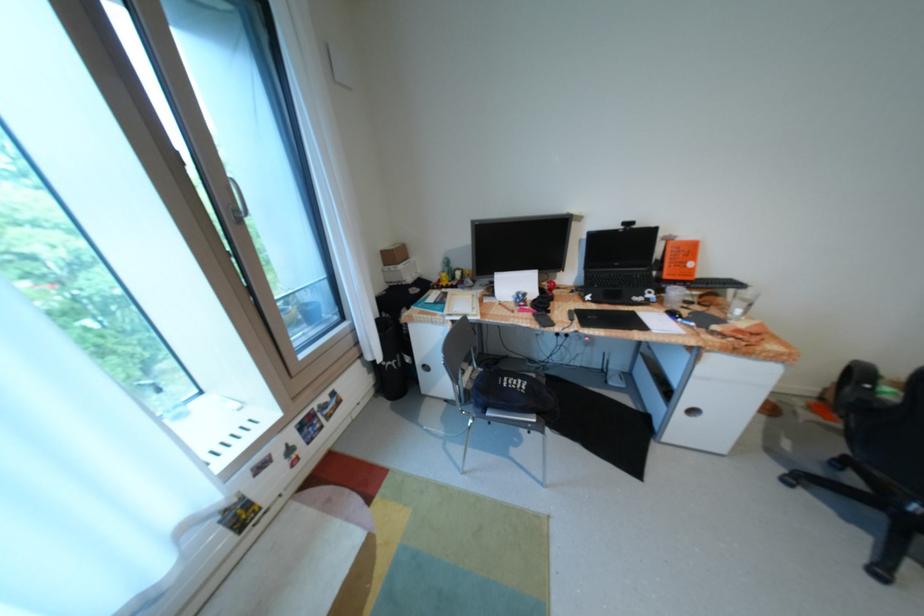
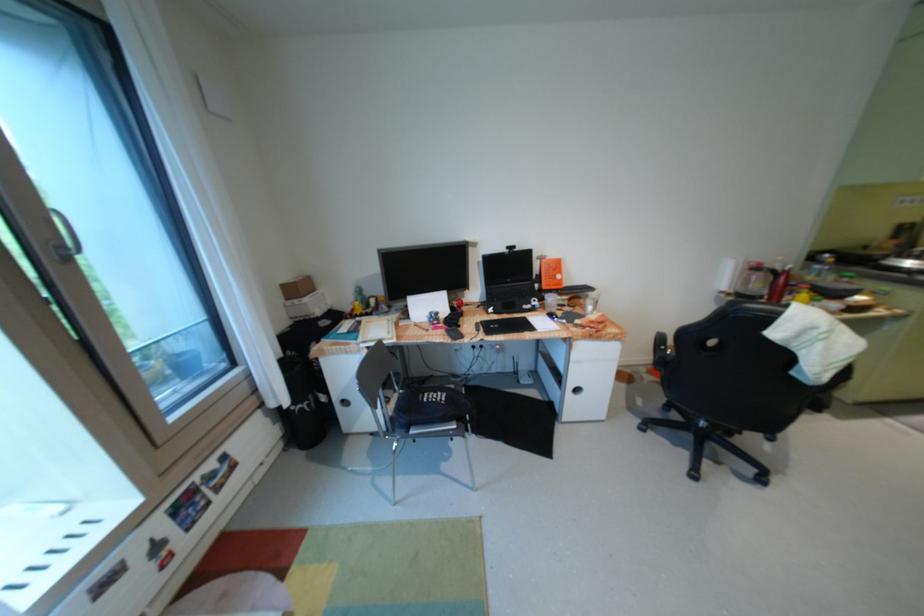
In the second image, find the point that corresponds to (824,402) in the first image.

(661, 368)